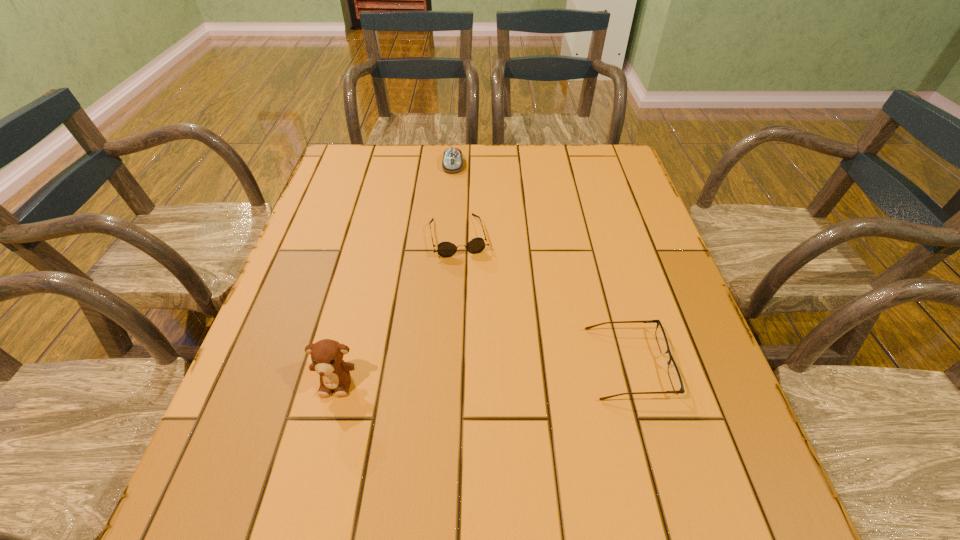
The width and height of the screenshot is (960, 540). I want to click on teddy bear, so click(x=327, y=355).

You are a GUI agent. You are given a task and a screenshot of the screen. Output one action in this format:
    pyautogui.click(x=<x>, y=<y>)
    Task: Click on the leftmost object
    
    Given the screenshot: What is the action you would take?
    pyautogui.click(x=327, y=355)

At what (x,y) coordinates should I click in order to perform the action: click on spectacles. Please return your answer as a coordinate pair (x, y). Looking at the image, I should click on (673, 372).

You are a GUI agent. You are given a task and a screenshot of the screen. Output one action in this format:
    pyautogui.click(x=<x>, y=<y>)
    Task: Click on the third nearest object
    
    Given the screenshot: What is the action you would take?
    pyautogui.click(x=445, y=249)

The image size is (960, 540). Identify the location of the farthest object. (452, 162).

Identify the location of vacant position located on the face of the leftmost object. (322, 441).

You are a GUI agent. You are given a task and a screenshot of the screen. Output one action in this format:
    pyautogui.click(x=<x>, y=<y>)
    Task: Click on the blank space located on the front-facing side of the second farthest object
    
    Given the screenshot: What is the action you would take?
    pyautogui.click(x=469, y=282)

Find the location of a particular element. free spot located on the front-facing side of the second farthest object is located at coordinates pyautogui.click(x=473, y=298).

Image resolution: width=960 pixels, height=540 pixels. Find the location of `vacant position located on the front-facing side of the second farthest object`. vacant position located on the front-facing side of the second farthest object is located at coordinates (478, 319).

Where is `vacant region located 0.300m on the wheel side of the farthest object`? vacant region located 0.300m on the wheel side of the farthest object is located at coordinates (450, 239).